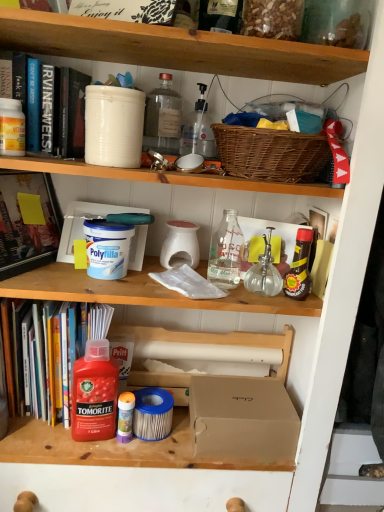
Question: Relative to transparent glass bottle at upper center, the third bottle when ordered from left to right, is hardcover book at upper left, which is the third book from bottom to top, in front or behind?

Choices:
 (A) behind
 (B) front

Answer: (B)

Question: In terms of height, does hardcover book at upper left, which is the third book from bottom to top, look taller or shorter compared to transparent glass bottle at upper center, arranged as the fifth bottle when viewed from the right?

Choices:
 (A) tall
 (B) short

Answer: (A)

Question: Based on their relative distances, which object is nearer to the translucent plastic glue stick at lower center, the sixth bottle when ordered from right to left?

Choices:
 (A) woven brown picnic basket at upper right
 (B) white matte polyfilla container at center-left, positioned as the 2th box in bottom-to-top order
 (C) white matte bucket at upper left, marked as the 3th bucket in a bottom-to-top arrangement
 (D) transparent glass bottle at upper center, arranged as the fifth bottle when viewed from the right
 (E) translucent plastic bottle at upper center, arranged as the 4th bottle when viewed from the right

Answer: (B)

Question: Estimate the real-world distances between objects in this image. Which object is closer to the white matte bucket at upper center, which is counted as the 2th bucket, starting from the bottom?

Choices:
 (A) hardcover book at upper left, which is the third book from bottom to top
 (B) white matte bucket at upper left, which is the first bucket in left-to-right order
 (C) transparent glass bottle at center-right, the 6th bottle in the left-to-right sequence
 (D) red glossy tomorite bottle at lower left, the first bottle when ordered from left to right
 (E) white matte polyfilla at center, the 2th bucket from the left

Answer: (A)